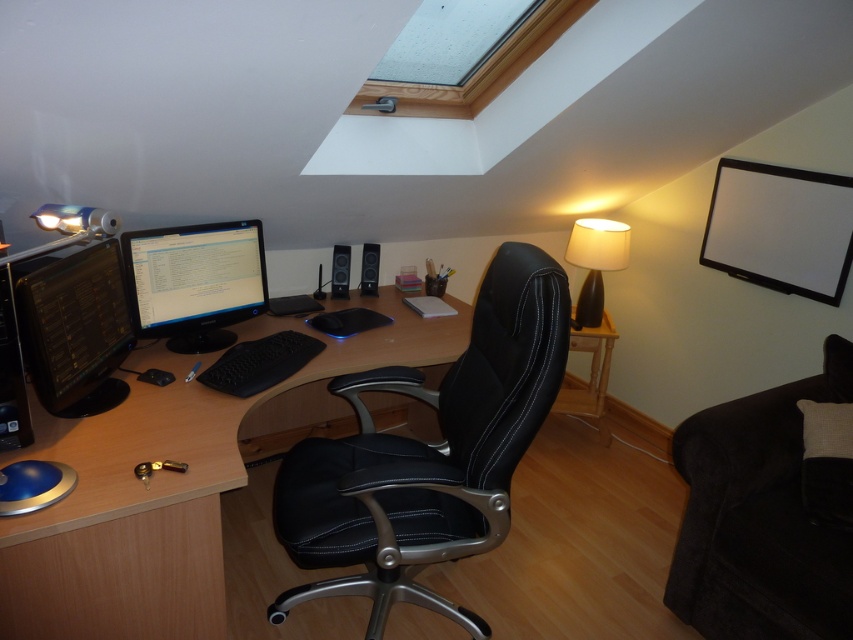
Question: Which point is farther from the camera taking this photo?

Choices:
 (A) (548, 365)
 (B) (160, 321)
 (C) (334, 253)
 (D) (367, 285)

Answer: (D)

Question: Considering the relative positions of black leather office chair at center and white glossy monitor at upper right in the image provided, where is black leather office chair at center located with respect to white glossy monitor at upper right?

Choices:
 (A) above
 (B) below

Answer: (B)

Question: Is black leather swivel chair at center bigger than matte black monitor at left?

Choices:
 (A) no
 (B) yes

Answer: (B)

Question: Which of these objects is positioned closest to the black matte speaker at center?

Choices:
 (A) black matte keyboard at center
 (B) matte black monitor at left
 (C) white glossy monitor at upper right
 (D) black leather swivel chair at center

Answer: (A)

Question: Is woodendesk at center closer to camera compared to black plastic speaker at center?

Choices:
 (A) no
 (B) yes

Answer: (B)

Question: Which object appears farthest from the camera in this image?

Choices:
 (A) white glossy monitor at upper right
 (B) matte black monitor at left
 (C) black matte speaker at center
 (D) black matte keyboard at center

Answer: (C)